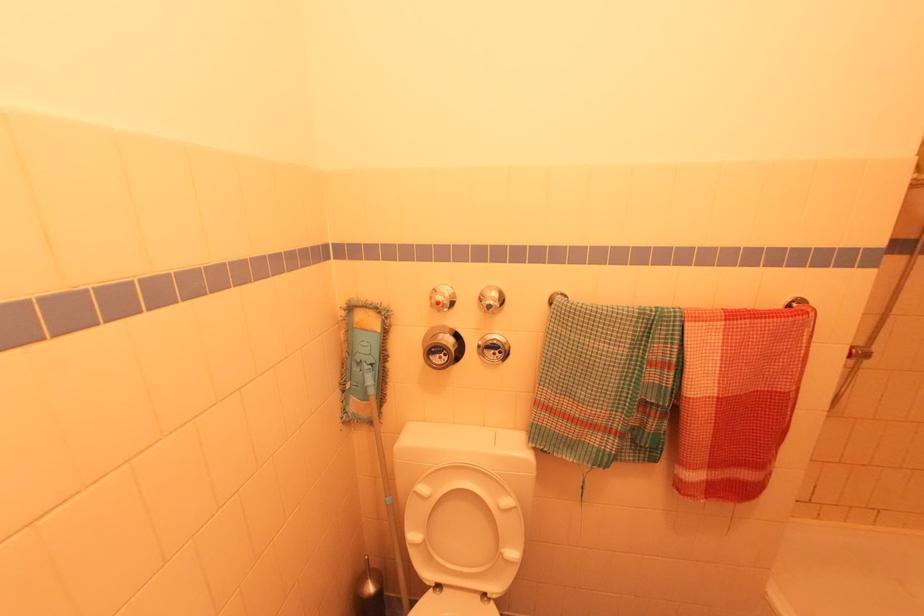
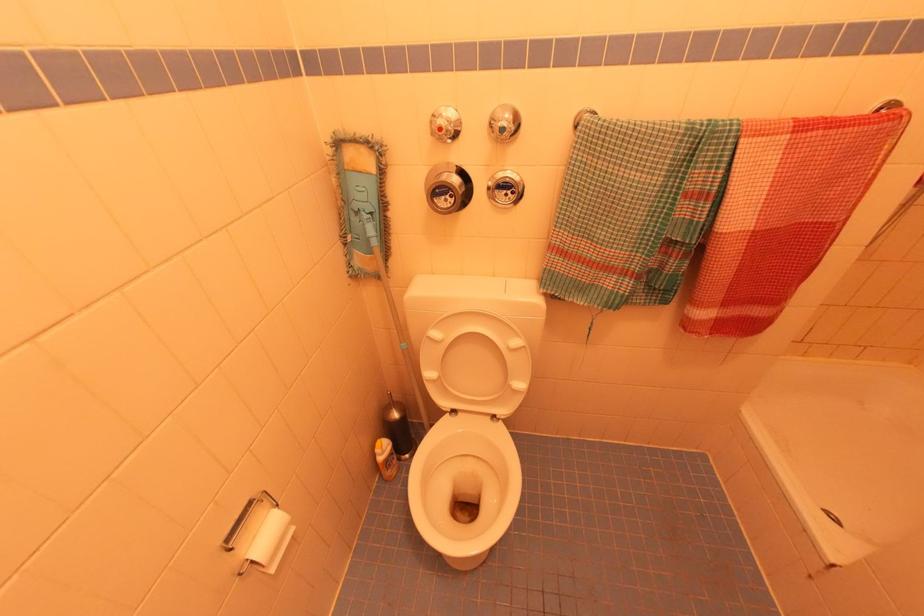
Question: I am providing you with two images of the same scene from different viewpoints. After the viewpoint changes to image2, which objects are now occluded?

Choices:
 (A) metal towel bar
 (B) white toilet lid
 (C) silver toilet brush handle
 (D) none of these

Answer: (D)